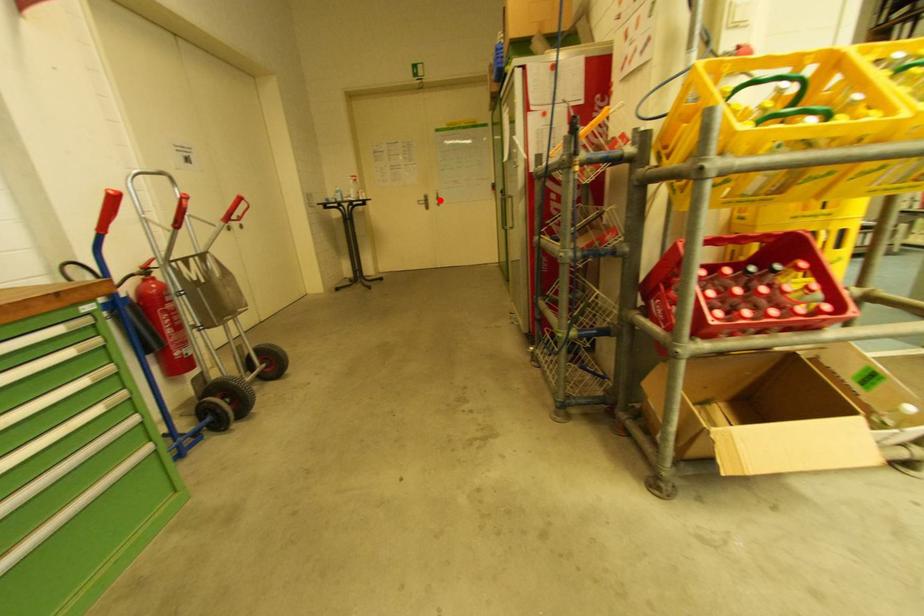
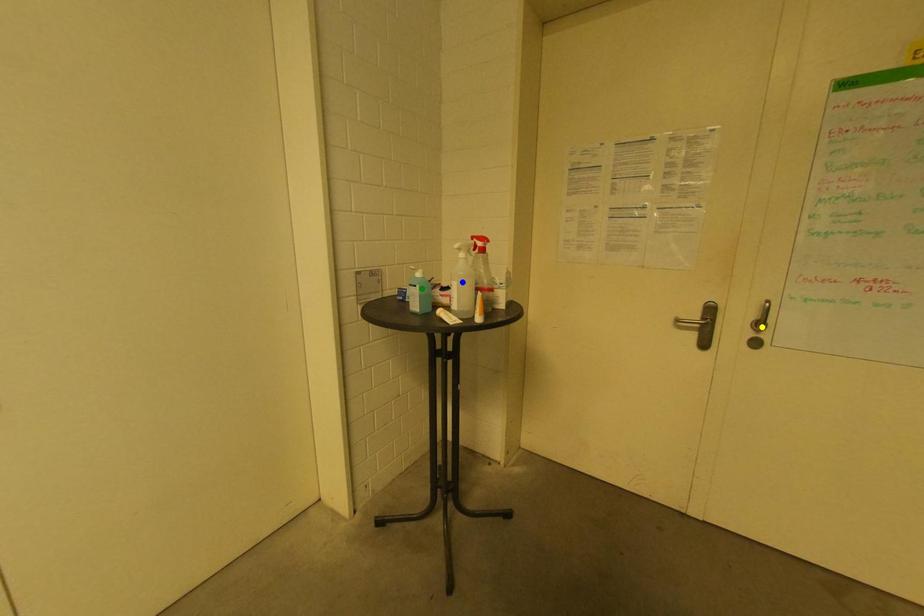
Question: I am providing you with two images of the same scene from different viewpoints. A red point is marked on the first image. You are given multiple points on the second image. Can you choose the point in image 2 that corresponds to the point in image 1?

Choices:
 (A) green point
 (B) yellow point
 (C) blue point

Answer: (B)